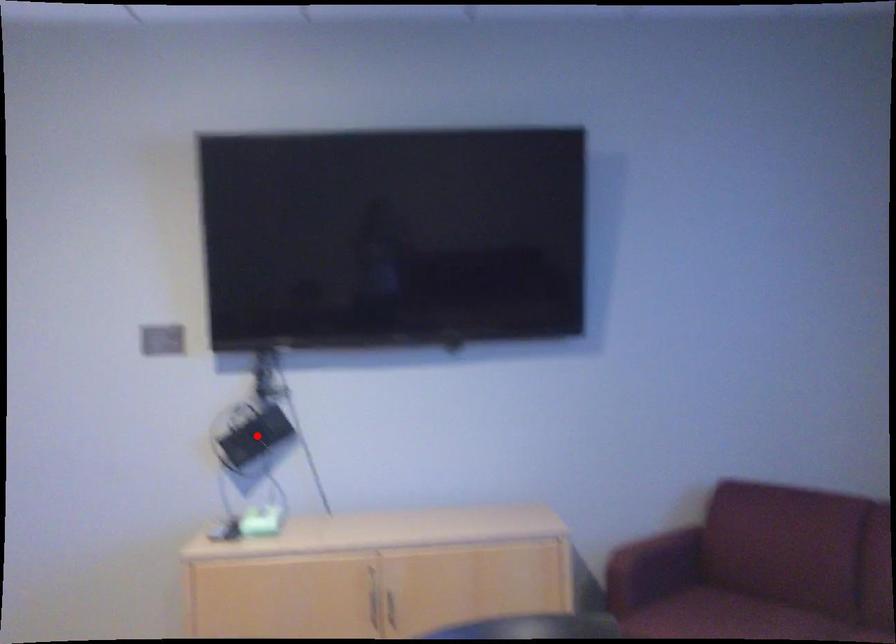
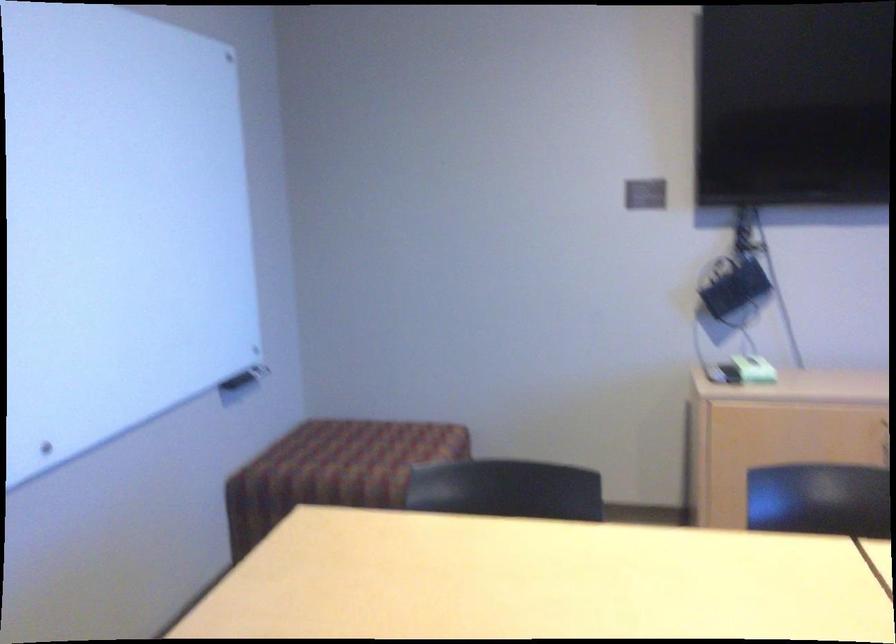
The point at the highlighted location is marked in the first image. Where is the corresponding point in the second image?

(734, 289)